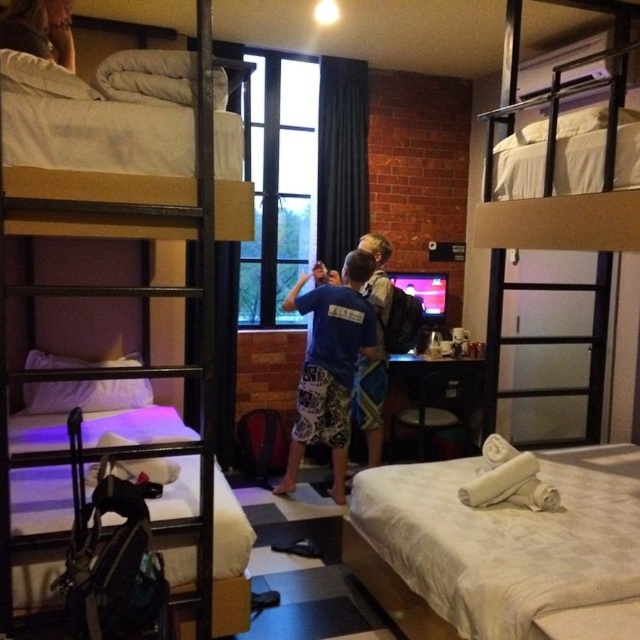
You are standing in the room and want to place a small plant between the two points, point (636, 445) and point (337, 461). Since the plant needs to be placed at a position that is equidistant from both points, will the plant be closer to the camera or further away compared to the point that is closer to the camera?

The plant placed equidistant between point (636, 445) and point (337, 461) will be closer to the camera than the point that is closer to the camera because the midpoint between them would be closer to the nearer point.